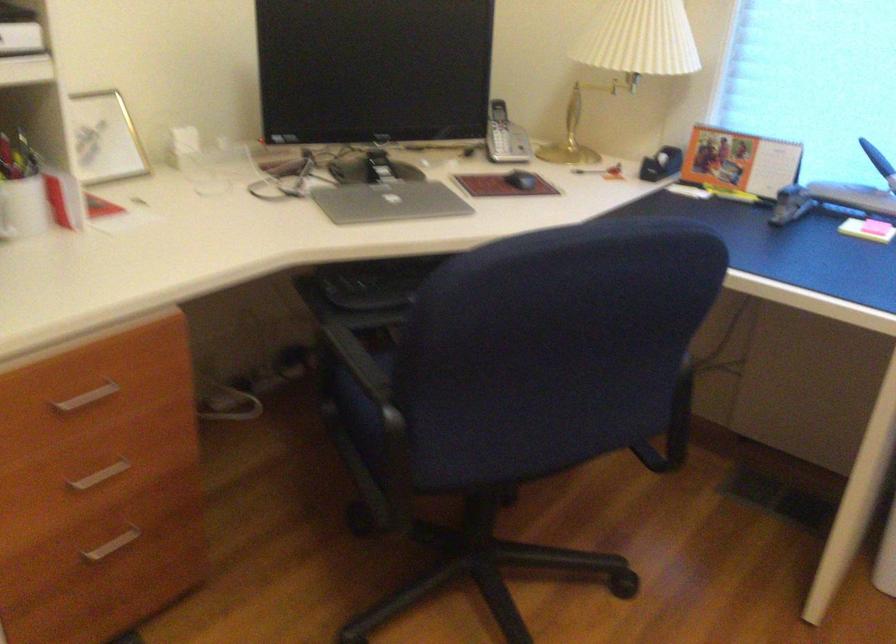
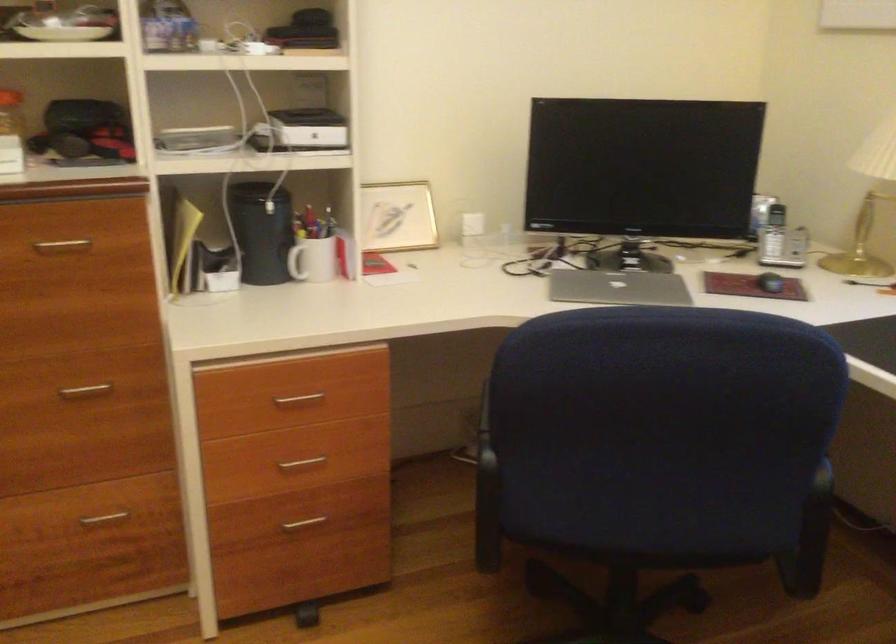
Question: The camera is either moving clockwise (left) or counter-clockwise (right) around the object. The first image is from the beginning of the video and the second image is from the end. Is the camera moving left or right when shooting the video?

Choices:
 (A) Left
 (B) Right

Answer: (B)